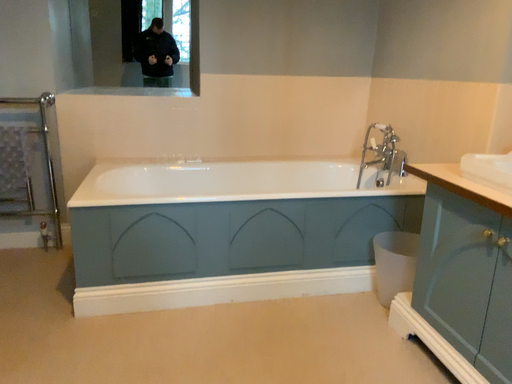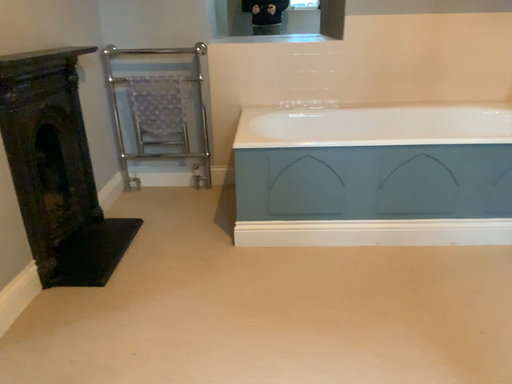
Question: Which way did the camera rotate in the video?

Choices:
 (A) rotated left
 (B) rotated right

Answer: (A)